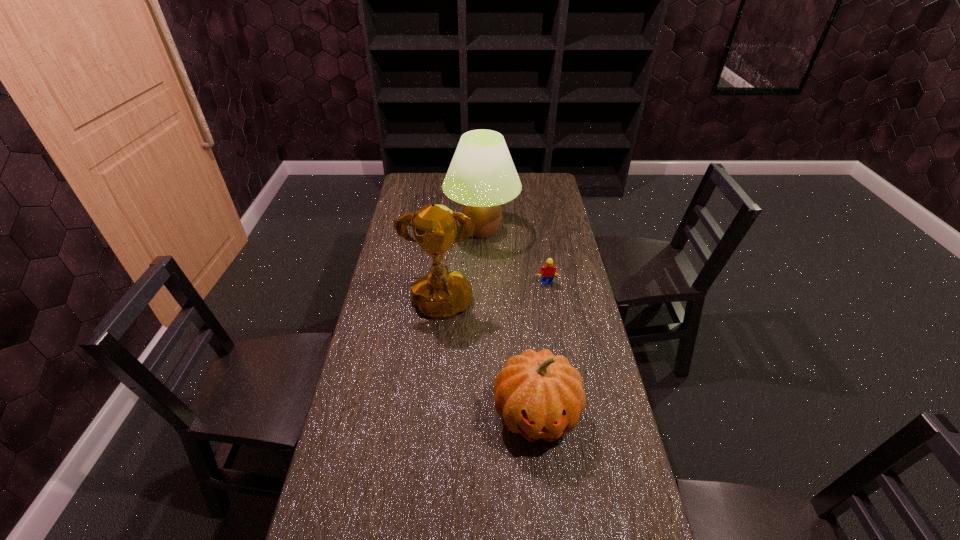
Where is `the farthest object`? the farthest object is located at coordinates (482, 176).

Where is `award`? award is located at coordinates (440, 294).

Identify the location of the second shortest object. (539, 395).

Where is `pumpkin`? pumpkin is located at coordinates point(539,395).

Identify the location of the shortest object. The height and width of the screenshot is (540, 960). (548, 270).

Image resolution: width=960 pixels, height=540 pixels. I want to click on free space located 0.050m on the shade of the farthest object, so [x=482, y=261].

I want to click on vacant space located 0.240m on the front side of the award, so click(x=431, y=403).

Identify the location of vacant space located on the carved face of the pumpkin. (546, 514).

At what (x,y) coordinates should I click in order to perform the action: click on vacant area situated 0.340m on the front-facing side of the Lego. Please return your answer as a coordinate pair (x, y). The height and width of the screenshot is (540, 960). Looking at the image, I should click on (559, 362).

Locate an element on the screen. The height and width of the screenshot is (540, 960). object present at the left edge is located at coordinates (440, 294).